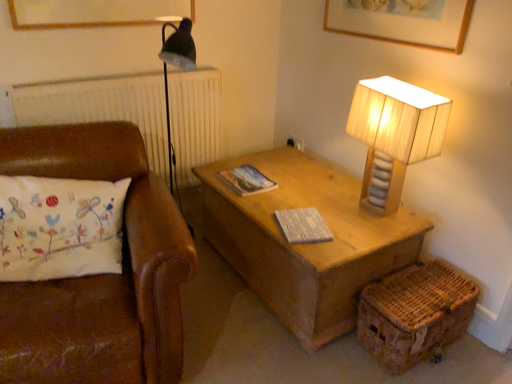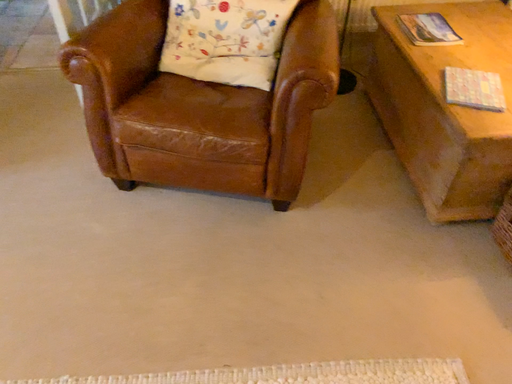
Question: Which way did the camera rotate in the video?

Choices:
 (A) rotated right
 (B) rotated left

Answer: (B)